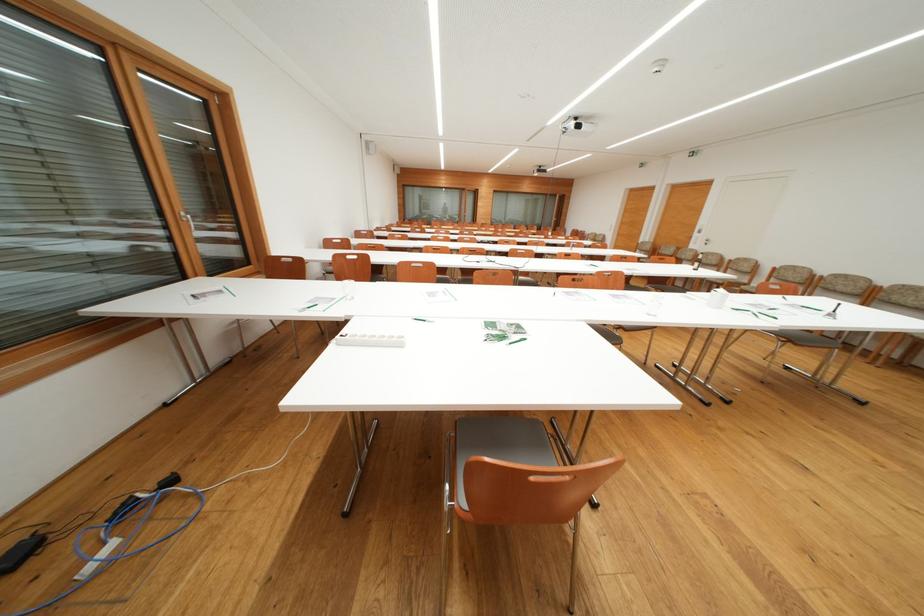
The width and height of the screenshot is (924, 616). What are the coordinates of `white power strip` in the screenshot? It's located at (370, 339).